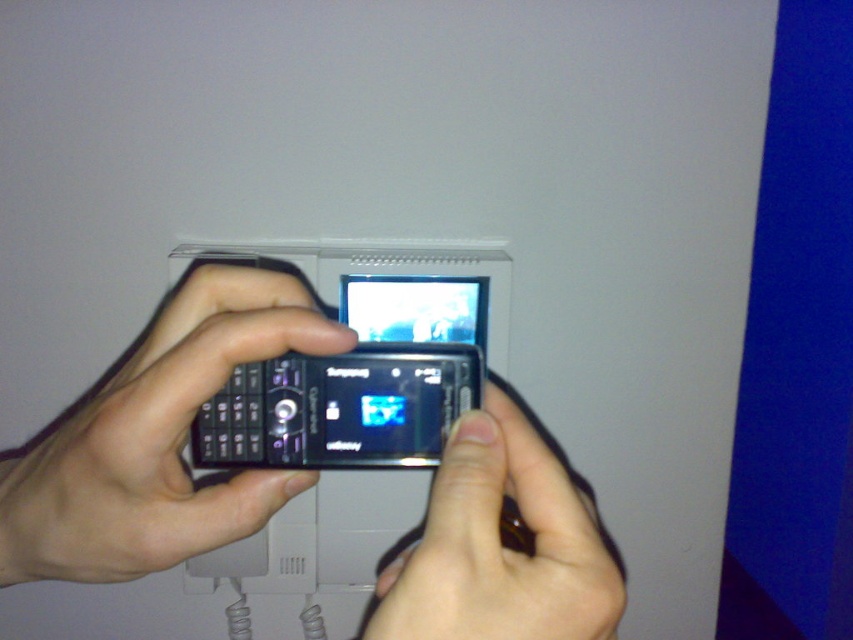
Is black glossy phone at center smaller than matte black phone at center?

Incorrect, black glossy phone at center is not smaller in size than matte black phone at center.

The image size is (853, 640). What do you see at coordinates (155, 440) in the screenshot?
I see `black glossy phone at center` at bounding box center [155, 440].

Locate an element on the screen. This screenshot has width=853, height=640. black glossy phone at center is located at coordinates (155, 440).